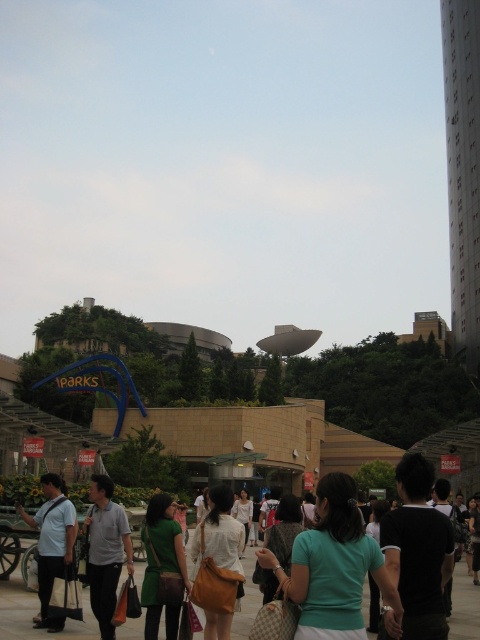
You are standing in the scene and want to take a photo of the gray cotton shirt at lower left without the green fabric crowd at center blocking the view. Is this possible?

The green fabric crowd at center is closer to the viewer than the gray cotton shirt at lower left, so the crowd would block the view of the shirt. You cannot take a clear photo of the gray cotton shirt at lower left without the crowd blocking it.

You are a fashion designer observing the scene and notice two green items. The first is the green fabric crowd at center, and the second is the matte green dress at center. Which of these two items has a bigger size?

The green fabric crowd at center has a larger size compared to the matte green dress at center.

You are standing at the edge of the scene and want to reach the matte green dress at center without walking through the green fabric crowd at center. Given that the shortest path between them is 6.78 meters, can you estimate if a person walking at a normal pace of 1.5 meters per second can reach the dress within 5 seconds?

The distance between the green fabric crowd at center and the matte green dress at center is 6.78 meters. At a normal walking pace of 1.5 meters per second, it would take approximately 4.52 seconds to cover this distance. Since 4.52 seconds is less than 5 seconds, the person can reach the matte green dress at center within the time limit.